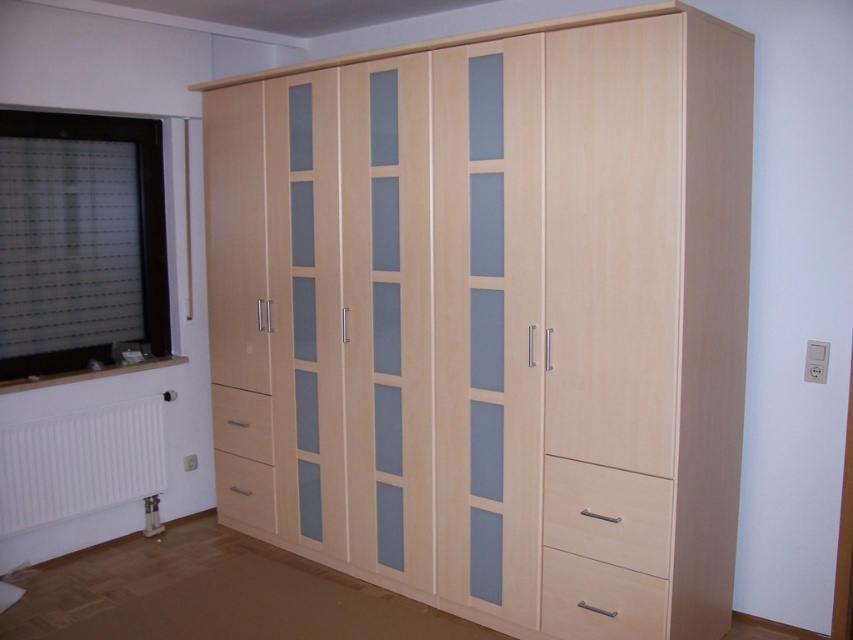
Does matte light brown drawer at lower left have a lesser height compared to light wood drawer at lower left?

No.

Is point (228, 417) farther from camera compared to point (218, 500)?

No, (228, 417) is in front of (218, 500).

Find the location of `matte light brown drawer at lower left`. matte light brown drawer at lower left is located at coordinates point(242,422).

Between matte light brown drawer at lower right and light wood drawer at lower left, which one has less height?

light wood drawer at lower left

This screenshot has width=853, height=640. Identify the location of matte light brown drawer at lower right. (607, 515).

Locate an element on the screen. The width and height of the screenshot is (853, 640). matte light brown drawer at lower right is located at coordinates (607, 515).

Can you confirm if light wood drawer at lower right is thinner than light wood drawer at lower left?

Correct, light wood drawer at lower right's width is less than light wood drawer at lower left's.

Which is in front, point (613, 586) or point (231, 460)?

Point (613, 586) is in front.

Where is `light wood drawer at lower right`? light wood drawer at lower right is located at coordinates (599, 600).